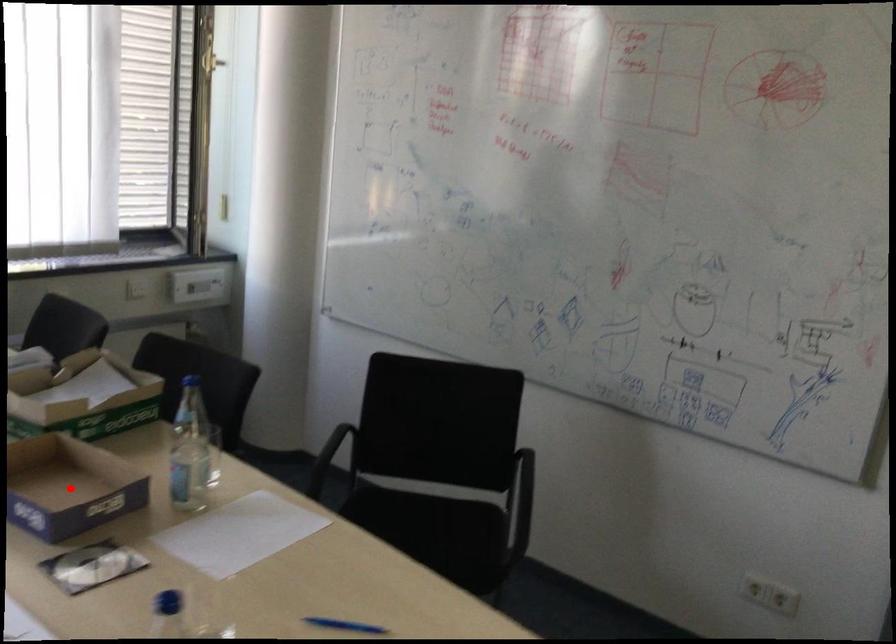
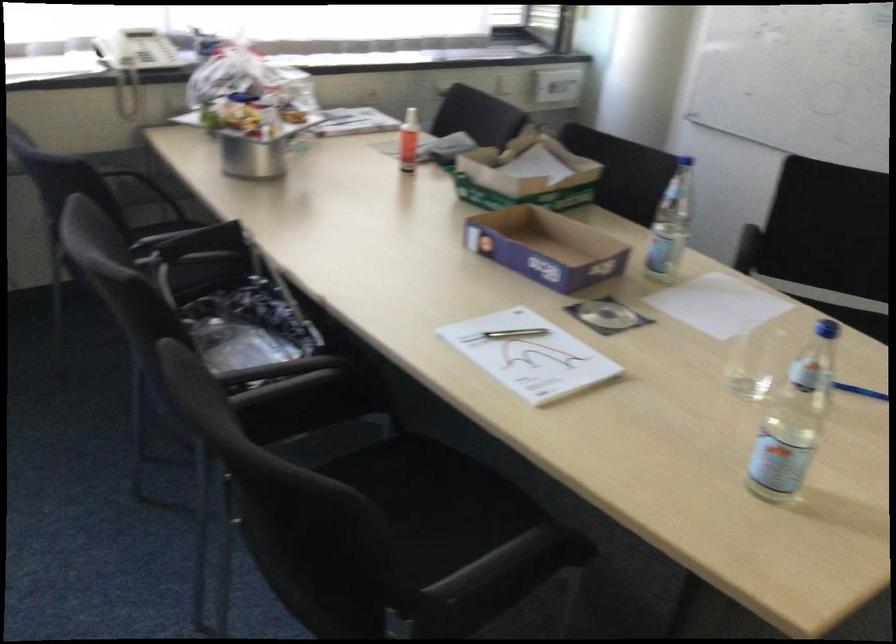
Question: A red point is marked in image1. In image2, is the corresponding 3D point closer to the camera or farther? Reply with the corresponding letter.

Choices:
 (A) The corresponding 3D point is closer.
 (B) The corresponding 3D point is farther.

Answer: (B)